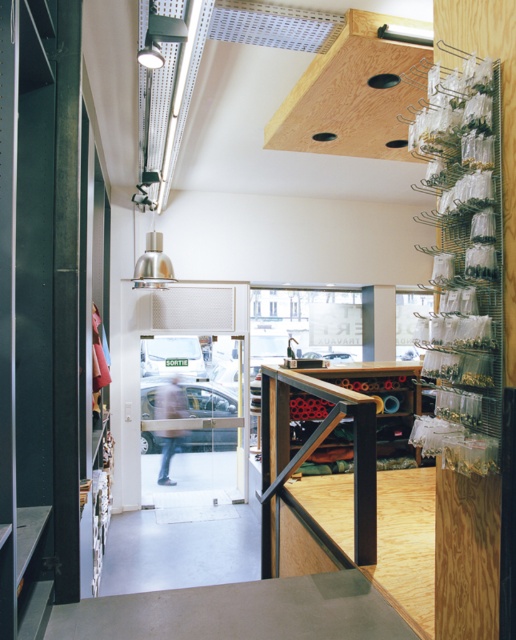
Question: Is natural wood exhaust hood at upper center thinner than plywood counter at center?

Choices:
 (A) no
 (B) yes

Answer: (B)

Question: Which object is positioned farthest from the natural wood exhaust hood at upper center?

Choices:
 (A) smooth concrete counter top at center
 (B) plywood counter at center

Answer: (A)

Question: Does natural wood exhaust hood at upper center have a greater width compared to plywood counter at center?

Choices:
 (A) yes
 (B) no

Answer: (B)

Question: Does natural wood exhaust hood at upper center have a smaller size compared to plywood counter at center?

Choices:
 (A) yes
 (B) no

Answer: (A)

Question: Based on their relative distances, which object is farther from the smooth concrete counter top at center?

Choices:
 (A) natural wood exhaust hood at upper center
 (B) plywood counter at center

Answer: (A)

Question: Estimate the real-world distances between objects in this image. Which object is closer to the plywood counter at center?

Choices:
 (A) natural wood exhaust hood at upper center
 (B) smooth concrete counter top at center

Answer: (B)